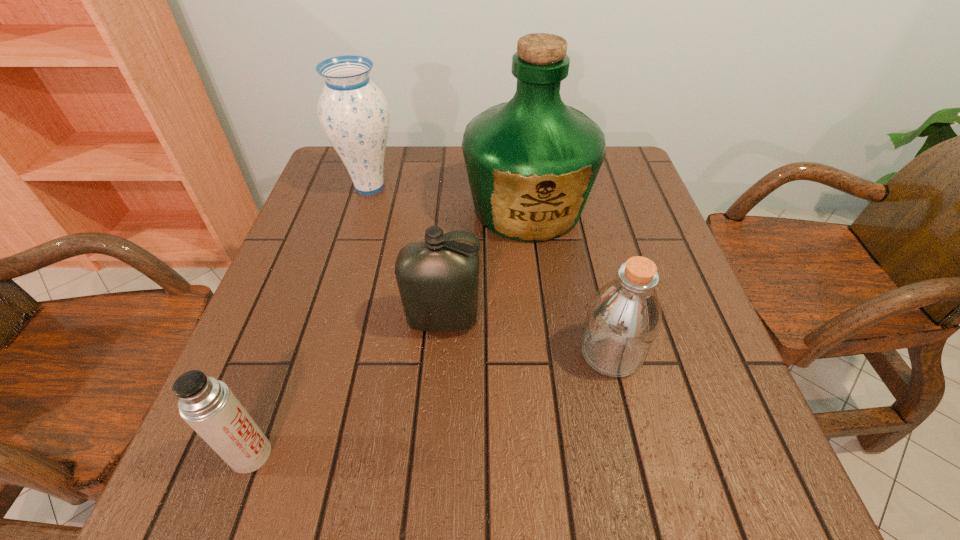
The width and height of the screenshot is (960, 540). In the image, there is a desktop. In order to click on free space at the far edge in this screenshot , I will do `click(432, 155)`.

In the image, there is a desktop. Identify the location of vacant space at the near edge. (510, 497).

Locate an element on the screen. vacant space at the left edge is located at coordinates (344, 282).

The width and height of the screenshot is (960, 540). In the image, there is a desktop. What are the coordinates of `vacant region at the right edge` in the screenshot? It's located at (685, 378).

The width and height of the screenshot is (960, 540). I want to click on free space at the near right corner of the desktop, so click(x=764, y=474).

Locate an element on the screen. This screenshot has width=960, height=540. free space between the thermos bottle and the vase is located at coordinates (310, 321).

At what (x,y) coordinates should I click in order to perform the action: click on unoccupied area between the left bottle and the right bottle. Please return your answer as a coordinate pair (x, y). This screenshot has height=540, width=960. Looking at the image, I should click on (527, 336).

This screenshot has height=540, width=960. In order to click on free space between the liquor and the right bottle in this screenshot , I will do `click(569, 281)`.

Locate an element on the screen. The height and width of the screenshot is (540, 960). vacant region between the second tallest object and the nearest object is located at coordinates (310, 321).

Find the location of a particular element. free space between the right bottle and the liquor is located at coordinates (569, 281).